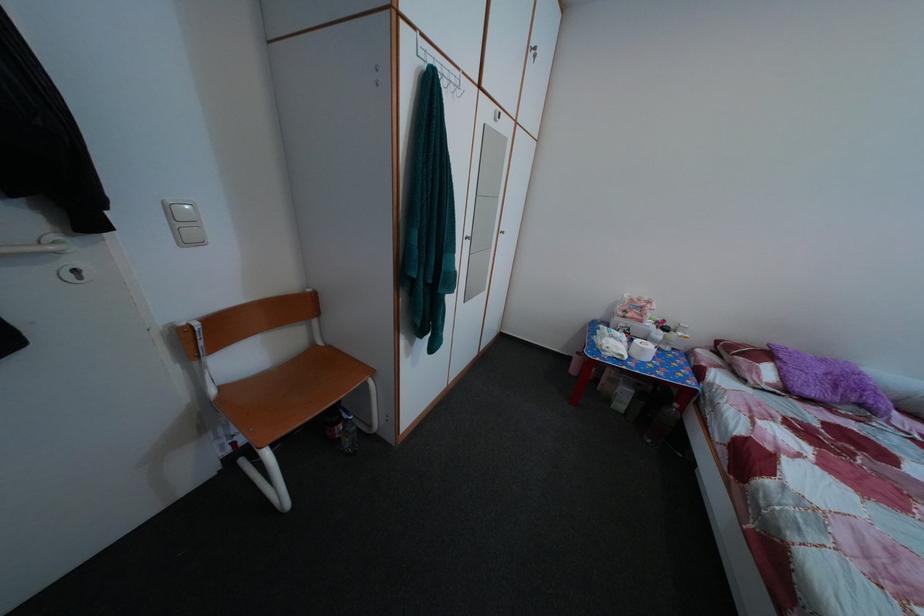
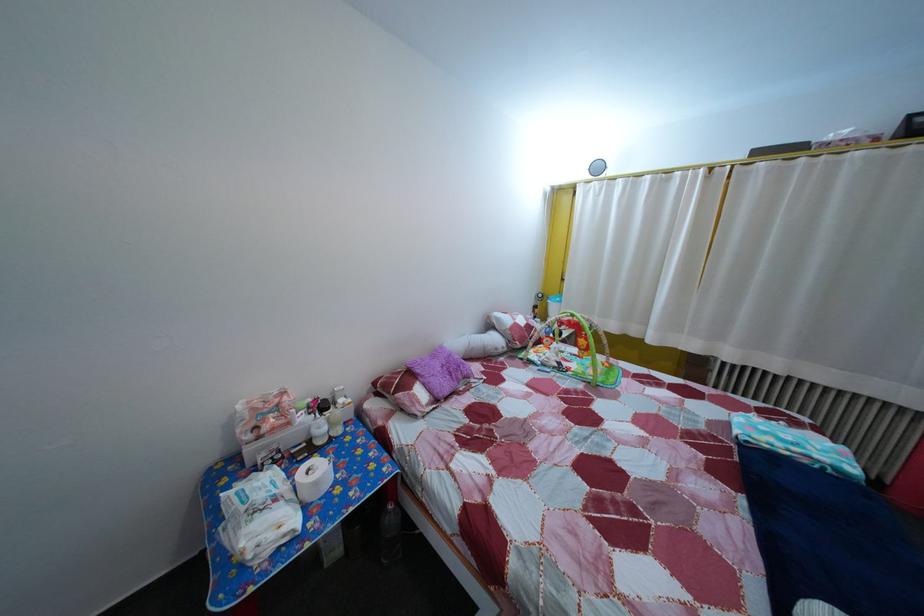
Where in the second image is the point corresponding to point (652, 358) from the first image?

(325, 491)